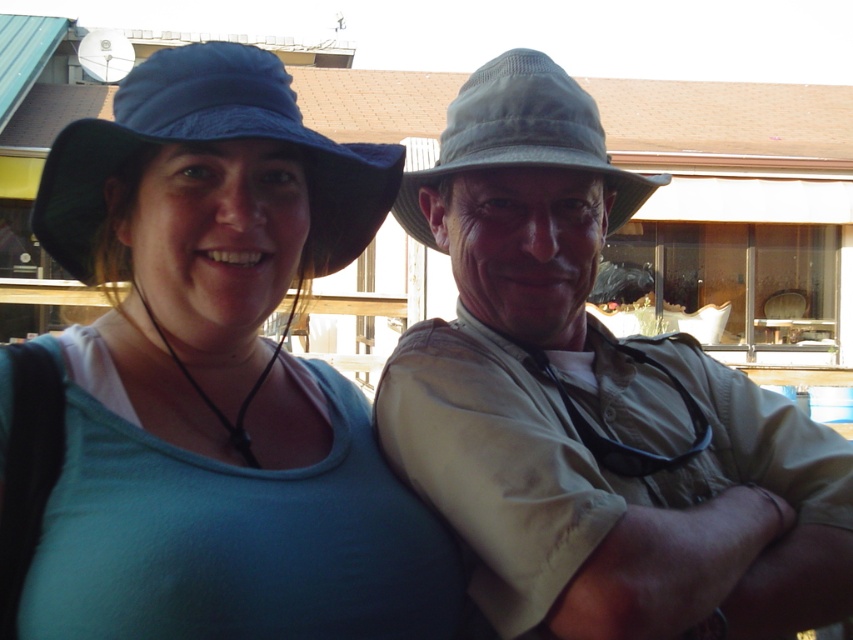
You are a photographer trying to capture a clear shot of the khaki fabric shirt at center and the blue fabric cowboy hat at left. Since you want both subjects in focus, you need to know which one is taller. Can you tell me which one is taller?

The khaki fabric shirt at center is much taller as the blue fabric cowboy hat at left, so the khaki fabric shirt at center is taller and should be focused on first to ensure both are in focus.